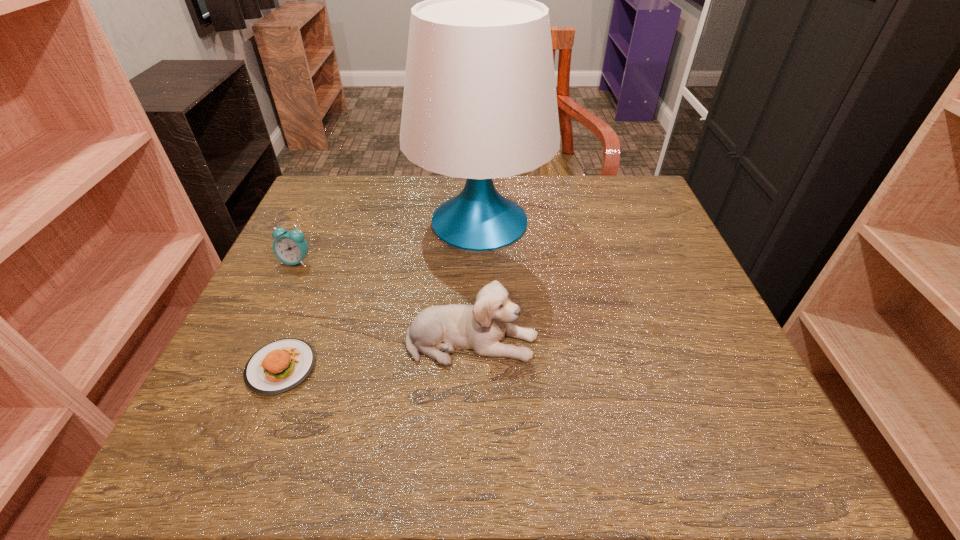
What are the coordinates of `vacant space that's between the table lamp and the second shortest object` in the screenshot? It's located at (388, 241).

Find the location of a particular element. This screenshot has height=540, width=960. free space between the tallest object and the second tallest object is located at coordinates (476, 281).

I want to click on vacant area that lies between the tallest object and the food, so click(x=381, y=294).

Locate an element on the screen. The height and width of the screenshot is (540, 960). unoccupied position between the puppy and the food is located at coordinates (376, 354).

This screenshot has height=540, width=960. What are the coordinates of `vacant region between the puppy and the shortest object` in the screenshot? It's located at click(376, 354).

You are a GUI agent. You are given a task and a screenshot of the screen. Output one action in this format:
    pyautogui.click(x=<x>, y=<y>)
    Task: Click on the vacant space that's between the puppy and the alarm clock
    This screenshot has width=960, height=540.
    Given the screenshot: What is the action you would take?
    [x=384, y=301]

I want to click on empty location between the third tallest object and the third shortest object, so click(x=384, y=301).

Find the location of a particular element. This screenshot has width=960, height=540. free space between the food and the table lamp is located at coordinates (381, 294).

Locate which object is the closest to the alarm clock. Please provide its 2D coordinates. Your answer should be formatted as a tuple, i.e. [(x, y)], where the tuple contains the x and y coordinates of a point satisfying the conditions above.

[(479, 102)]

This screenshot has height=540, width=960. In order to click on object that is the third nearest to the third shortest object in this screenshot , I will do `click(290, 247)`.